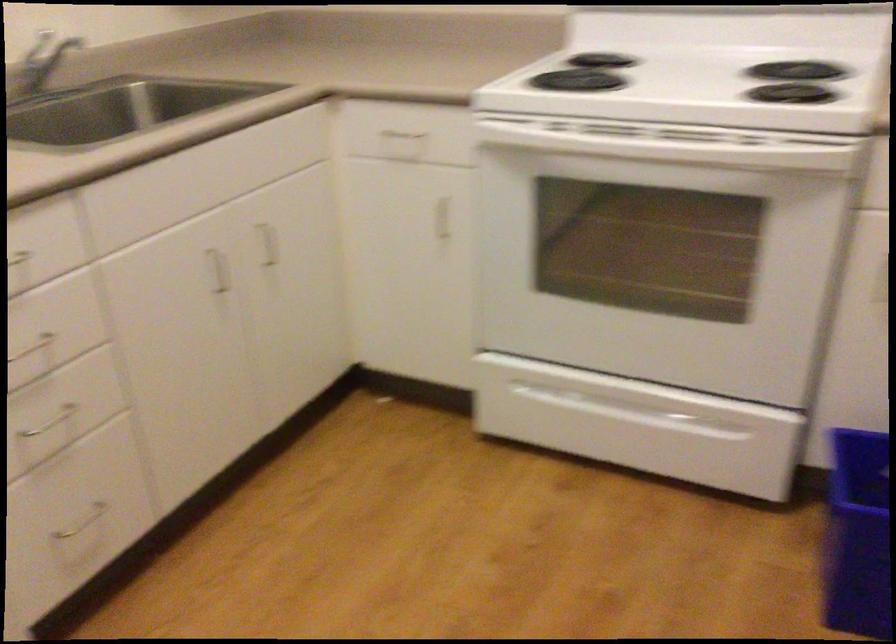
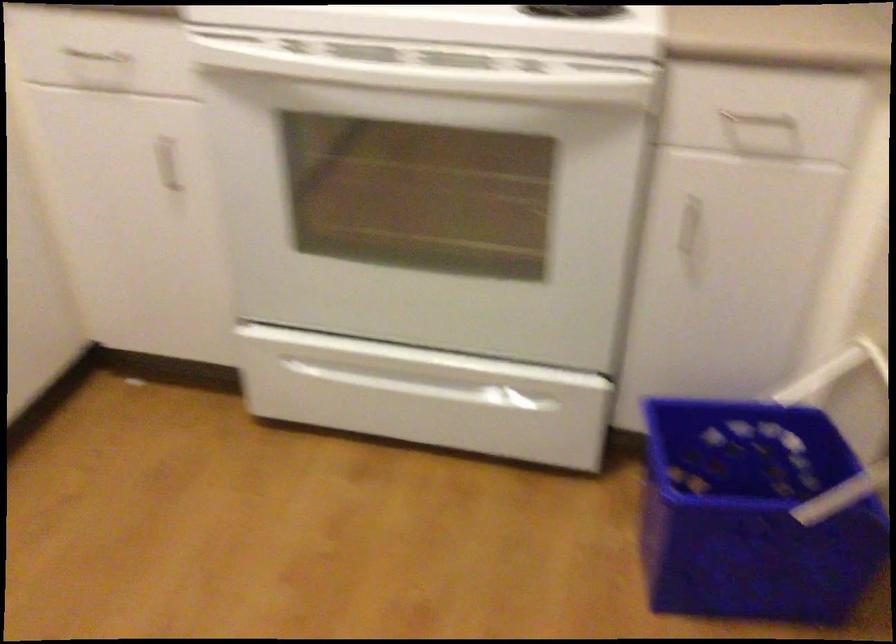
Where in the second image is the point corresponding to point (669, 144) from the first image?

(437, 77)